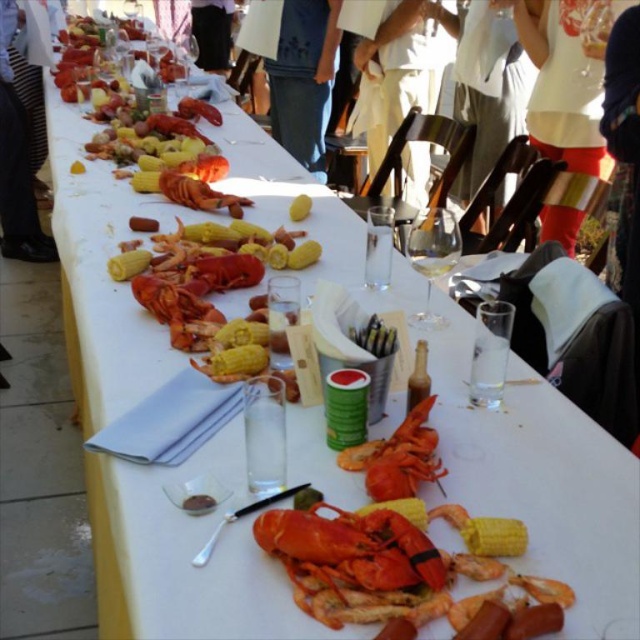
Question: Can you confirm if shiny orange lobster at center is smaller than black fabric pants at upper center?

Choices:
 (A) no
 (B) yes

Answer: (B)

Question: Is striped fabric pants at left bigger than black fabric pants at upper center?

Choices:
 (A) no
 (B) yes

Answer: (B)

Question: Which of the following is the farthest from the observer?

Choices:
 (A) orange lobster at center
 (B) black fabric pants at upper center

Answer: (B)

Question: Which point is closer to the camera taking this photo?

Choices:
 (A) (392, 534)
 (B) (33, 253)
 (C) (378, 449)
 (D) (204, 64)

Answer: (A)

Question: Which point is closer to the camera?

Choices:
 (A) (32, 186)
 (B) (420, 241)
 (C) (420, 429)
 (D) (198, 36)

Answer: (C)

Question: Is orange lobster at center further to the viewer compared to black fabric pants at upper center?

Choices:
 (A) no
 (B) yes

Answer: (A)